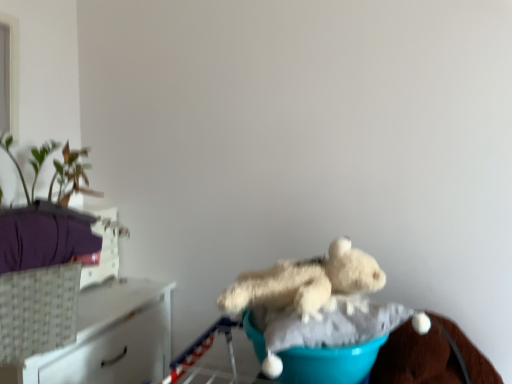
Question: Considering the relative sizes of white woven basket at left and woven white basket at left in the image provided, is white woven basket at left bigger than woven white basket at left?

Choices:
 (A) yes
 (B) no

Answer: (A)

Question: Is white woven basket at left beside woven white basket at left?

Choices:
 (A) no
 (B) yes

Answer: (A)

Question: From the image's perspective, is white woven basket at left beneath woven white basket at left?

Choices:
 (A) yes
 (B) no

Answer: (A)

Question: Can you confirm if white woven basket at left is wider than woven white basket at left?

Choices:
 (A) no
 (B) yes

Answer: (B)

Question: Does white woven basket at left have a lesser height compared to woven white basket at left?

Choices:
 (A) yes
 (B) no

Answer: (B)

Question: Is white woven basket at left spatially inside teal fabric at center, or outside of it?

Choices:
 (A) inside
 (B) outside

Answer: (B)

Question: Considering the positions of white woven basket at left and teal fabric at center in the image, is white woven basket at left wider or thinner than teal fabric at center?

Choices:
 (A) wide
 (B) thin

Answer: (A)

Question: Based on their sizes in the image, would you say white woven basket at left is bigger or smaller than teal fabric at center?

Choices:
 (A) small
 (B) big

Answer: (B)

Question: Would you say white woven basket at left is to the left or to the right of teal fabric at center in the picture?

Choices:
 (A) right
 (B) left

Answer: (B)

Question: Considering the positions of point (309, 375) and point (330, 264), is point (309, 375) closer or farther from the camera than point (330, 264)?

Choices:
 (A) farther
 (B) closer

Answer: (B)

Question: From a real-world perspective, is teal fabric at center positioned above or below fluffy white teddy bear at center?

Choices:
 (A) below
 (B) above

Answer: (A)

Question: Considering their positions, is teal fabric at center located in front of or behind fluffy white teddy bear at center?

Choices:
 (A) front
 (B) behind

Answer: (A)

Question: Is teal fabric at center taller or shorter than fluffy white teddy bear at center?

Choices:
 (A) tall
 (B) short

Answer: (B)

Question: From a real-world perspective, is fluffy white teddy bear at center physically located above or below teal fabric at center?

Choices:
 (A) above
 (B) below

Answer: (A)

Question: In terms of height, does fluffy white teddy bear at center look taller or shorter compared to teal fabric at center?

Choices:
 (A) tall
 (B) short

Answer: (A)